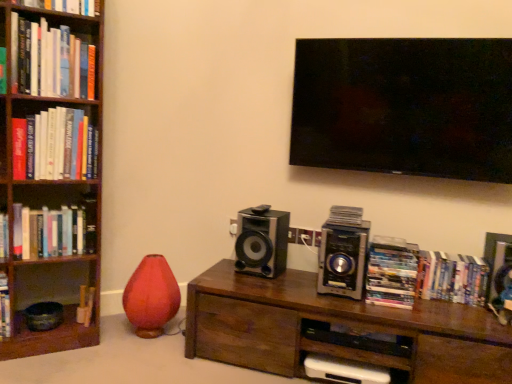
You are a GUI agent. You are given a task and a screenshot of the screen. Output one action in this format:
    pyautogui.click(x=<x>, y=<y>)
    Task: Click on the unoccupied area in front of hardcover books at center right, which is the fifth book in top-to-bottom order
    The image size is (512, 384).
    Given the screenshot: What is the action you would take?
    pyautogui.click(x=410, y=311)